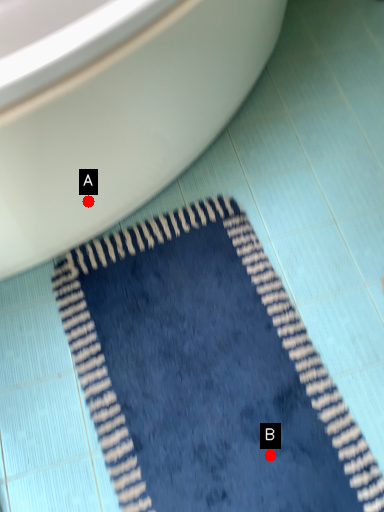
Question: Two points are circled on the image, labeled by A and B beside each circle. Which point appears closest to the camera in this image?

Choices:
 (A) A is closer
 (B) B is closer

Answer: (B)